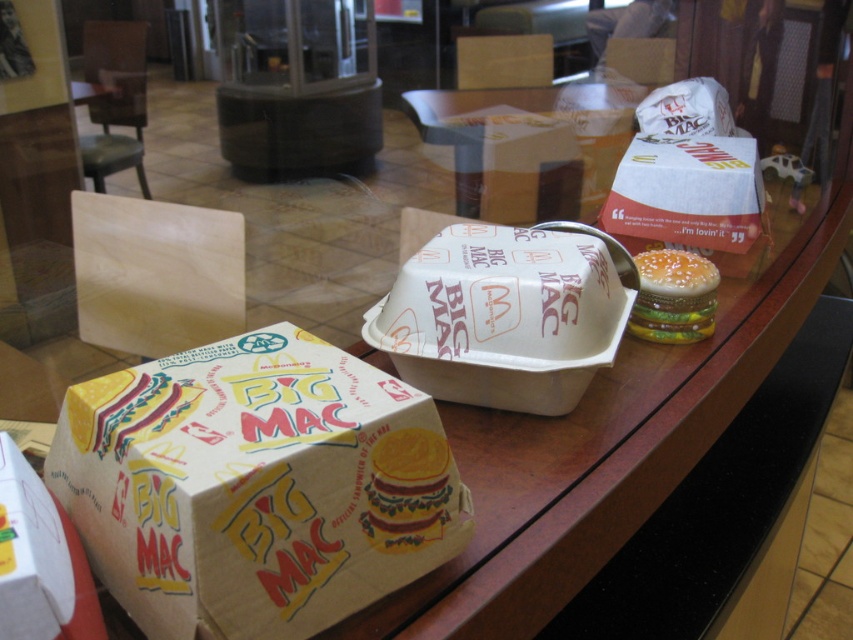
Does point (287, 476) lie in front of point (677, 284)?

Yes, it is.

Image resolution: width=853 pixels, height=640 pixels. What do you see at coordinates (254, 484) in the screenshot?
I see `yellow paper big mac box at center` at bounding box center [254, 484].

Image resolution: width=853 pixels, height=640 pixels. Identify the location of yellow paper big mac box at center. (254, 484).

Locate an element on the screen. The width and height of the screenshot is (853, 640). yellow paper big mac box at center is located at coordinates (254, 484).

Who is more distant from viewer, (444, 524) or (437, 468)?

The point (444, 524) is behind.

This screenshot has height=640, width=853. What are the coordinates of `yellow paper big mac box at center` in the screenshot? It's located at (254, 484).

Is point (364, 483) positioned after point (683, 301)?

No.

Is yellow paper big mac at center below burgundy glossy burger at right?

Correct, yellow paper big mac at center is located below burgundy glossy burger at right.

Is point (393, 545) positioned after point (689, 273)?

No, it is not.

The image size is (853, 640). What are the coordinates of `yellow paper big mac at center` in the screenshot? It's located at (407, 490).